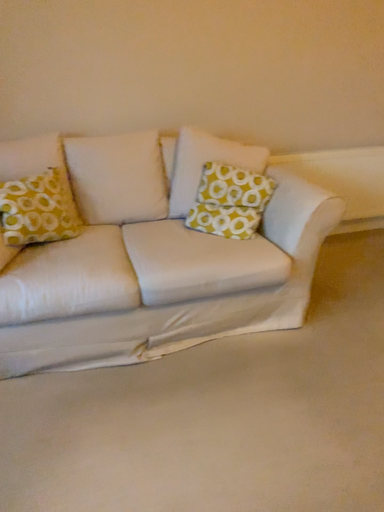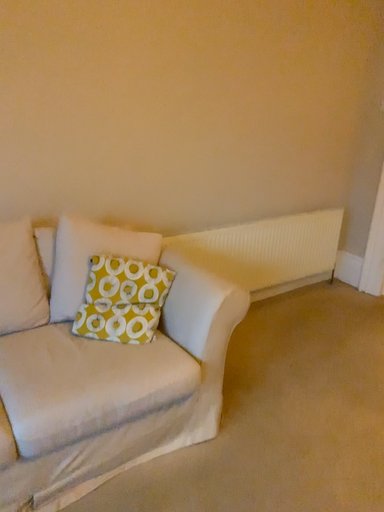
Question: Which way did the camera rotate in the video?

Choices:
 (A) rotated upward
 (B) rotated downward

Answer: (A)